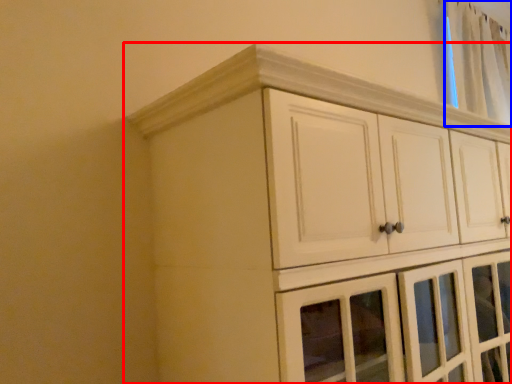
Question: Which object is further to the camera taking this photo, cupboard (highlighted by a red box) or curtain (highlighted by a blue box)?

Choices:
 (A) cupboard
 (B) curtain

Answer: (B)